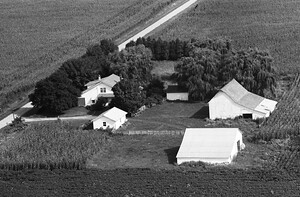
This screenshot has width=300, height=197. I want to click on window, so click(102, 88).